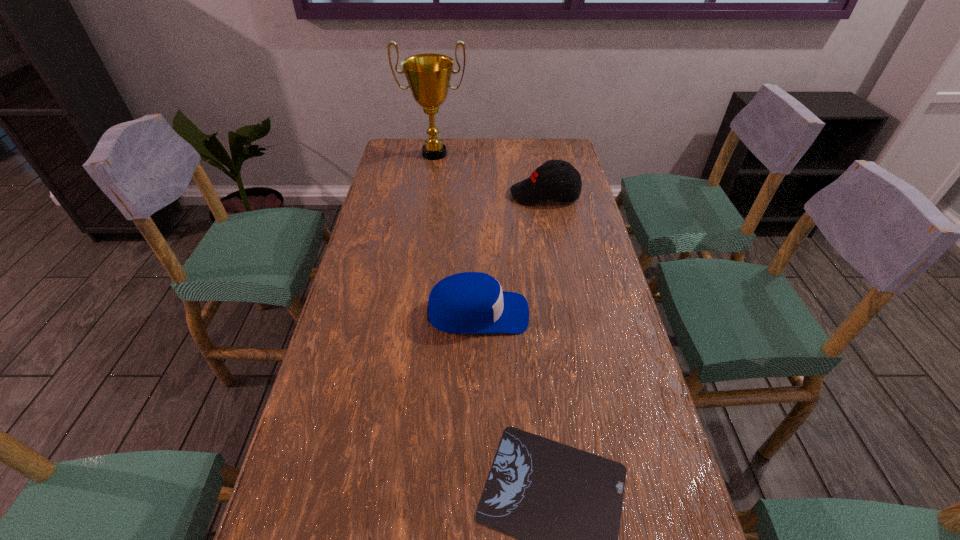
Where is `award`? This screenshot has width=960, height=540. award is located at coordinates (428, 75).

Locate an element on the screen. the tallest object is located at coordinates (428, 75).

The height and width of the screenshot is (540, 960). Find the location of `the farther baseball cap`. the farther baseball cap is located at coordinates (545, 182).

Locate an element on the screen. the nearer baseball cap is located at coordinates (470, 302).

Find the location of a particular element. Image resolution: width=960 pixels, height=540 pixels. free space located 0.370m on the front view with handles of the tallest object is located at coordinates (424, 225).

Locate an element on the screen. free space located on the front-facing side of the third nearest object is located at coordinates (496, 195).

Where is `free location located on the front-facing side of the third nearest object`? free location located on the front-facing side of the third nearest object is located at coordinates (436, 195).

Find the location of a particular element. The image size is (960, 540). free region located 0.070m on the front-facing side of the third nearest object is located at coordinates (491, 195).

Identify the location of vacant space located 0.160m on the front-facing side of the third farthest object. (590, 314).

In order to click on object positioned at the far edge in this screenshot , I will do `click(428, 75)`.